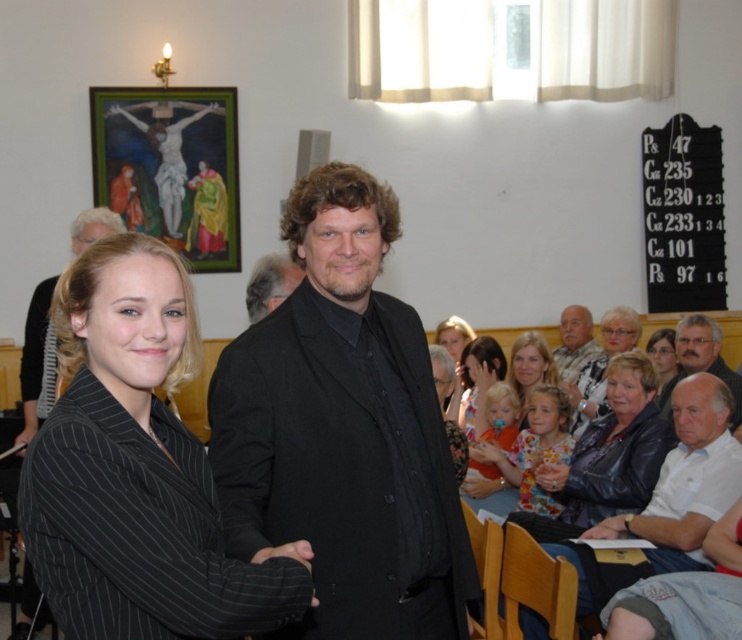
Who is more forward, (116, 532) or (680, 356)?

Point (116, 532) is more forward.

Is black pinstripe blazer at center above gray hair man at lower right?

Yes.

Where is `black pinstripe blazer at center`? The height and width of the screenshot is (640, 742). black pinstripe blazer at center is located at coordinates (137, 468).

Does black matte suit at center come in front of white textured shirt at lower right?

Yes, black matte suit at center is closer to the viewer.

Who is shorter, black matte suit at center or white textured shirt at lower right?

white textured shirt at lower right

Which is behind, point (324, 467) or point (604, 317)?

Positioned behind is point (604, 317).

Where is `black matte suit at center`? Image resolution: width=742 pixels, height=640 pixels. black matte suit at center is located at coordinates (344, 432).

Is point (91, 344) behind point (516, 368)?

No, (91, 344) is closer to viewer.

Between black pinstripe blazer at center and smooth blonde hair at center, which one appears on the left side from the viewer's perspective?

From the viewer's perspective, black pinstripe blazer at center appears more on the left side.

What do you see at coordinates (137, 468) in the screenshot?
I see `black pinstripe blazer at center` at bounding box center [137, 468].

You are a GUI agent. You are given a task and a screenshot of the screen. Output one action in this format:
    pyautogui.click(x=<x>, y=<y>)
    Task: Click on the black pinstripe blazer at center
    This screenshot has width=742, height=640.
    Given the screenshot: What is the action you would take?
    pyautogui.click(x=137, y=468)